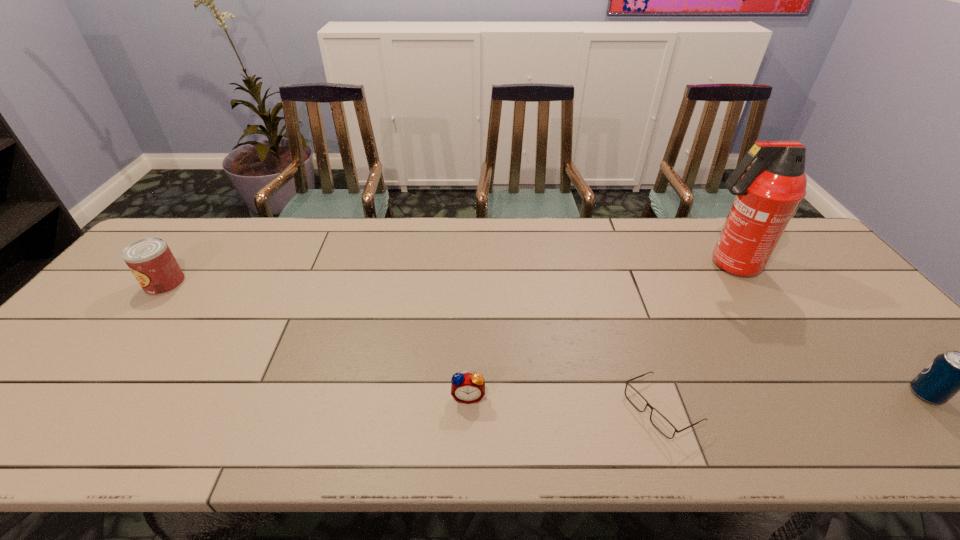
Identify the location of the tallest object. The height and width of the screenshot is (540, 960). (767, 195).

Find the location of a particular element. fire extinguisher is located at coordinates (767, 195).

At what (x,y) coordinates should I click in order to perform the action: click on can. Please return your answer as a coordinate pair (x, y). Looking at the image, I should click on (151, 261).

This screenshot has width=960, height=540. I want to click on soda can, so click(x=950, y=372).

Where is `alarm clock`? This screenshot has height=540, width=960. alarm clock is located at coordinates (468, 388).

The image size is (960, 540). Identify the location of the second shortest object. (468, 388).

At what (x,y) coordinates should I click in order to perform the action: click on the shortest object. Please return your answer as a coordinate pair (x, y). Image resolution: width=960 pixels, height=540 pixels. Looking at the image, I should click on (662, 424).

Locate an element on the screen. spectacles is located at coordinates (662, 424).

You are a GUI agent. You are given a task and a screenshot of the screen. Output one action in this format:
    pyautogui.click(x=<x>, y=<y>)
    Task: Click on the free region located on the trigger side of the tallest object
    This screenshot has width=960, height=540.
    Given the screenshot: What is the action you would take?
    pyautogui.click(x=620, y=265)

Image resolution: width=960 pixels, height=540 pixels. In order to click on free space located 0.390m on the trigger side of the tallest object in this screenshot , I will do `click(567, 265)`.